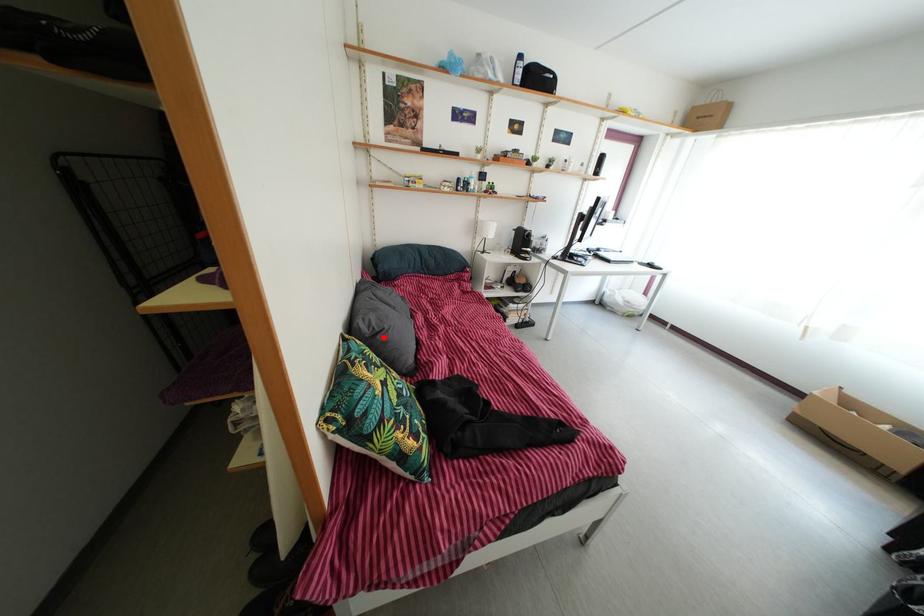
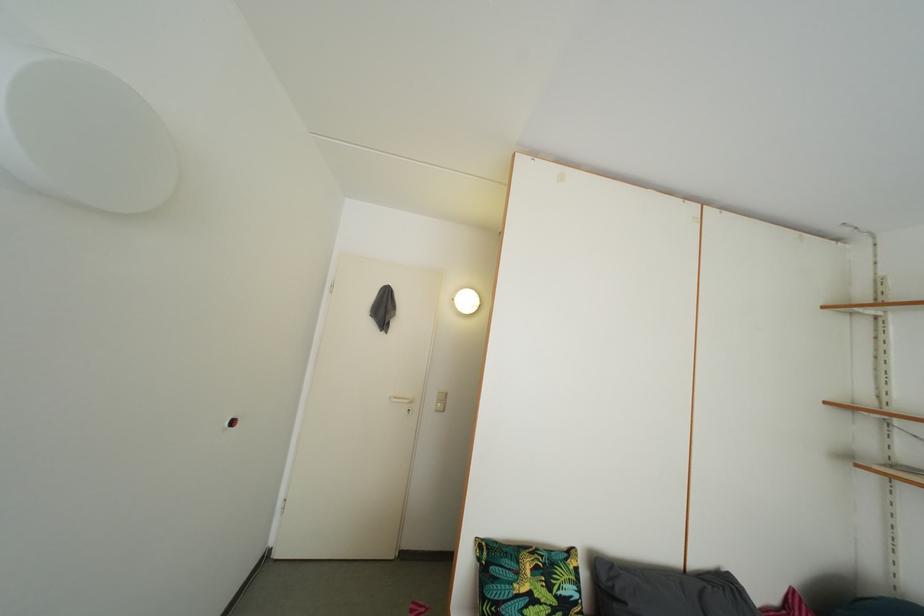
Find the pixel in the second image that matches the highlighted location in the first image.

(624, 601)